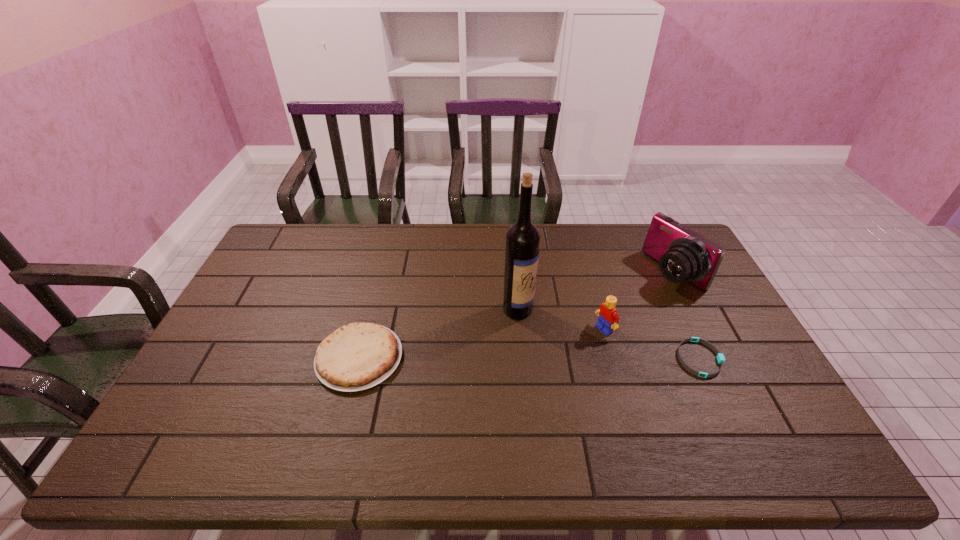
Identify the location of object present at the far edge. This screenshot has height=540, width=960. (684, 255).

Where is `object present at the near edge`? object present at the near edge is located at coordinates (357, 356).

Image resolution: width=960 pixels, height=540 pixels. I want to click on wristband that is at the right edge, so click(x=720, y=357).

Where is `camera located in the right edge section of the desktop`? The height and width of the screenshot is (540, 960). camera located in the right edge section of the desktop is located at coordinates (684, 255).

Where is `object that is at the far right corner`? This screenshot has height=540, width=960. object that is at the far right corner is located at coordinates (684, 255).

What are the coordinates of `vacant position at the far edge of the desktop` in the screenshot? It's located at (539, 228).

The height and width of the screenshot is (540, 960). Identify the location of vacant space at the near edge of the desktop. (381, 407).

I want to click on blank area at the left edge, so click(x=230, y=369).

In the image, there is a desktop. What are the coordinates of `vacant space at the right edge` in the screenshot? It's located at (696, 354).

The height and width of the screenshot is (540, 960). Find the location of `vacant space at the far left corner of the desktop`. vacant space at the far left corner of the desktop is located at coordinates (304, 237).